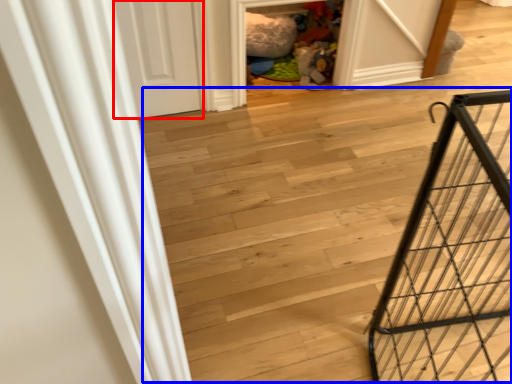
Question: Which point is closer to the camera, door (highlighted by a red box) or stairwell (highlighted by a blue box)?

Choices:
 (A) door
 (B) stairwell

Answer: (B)